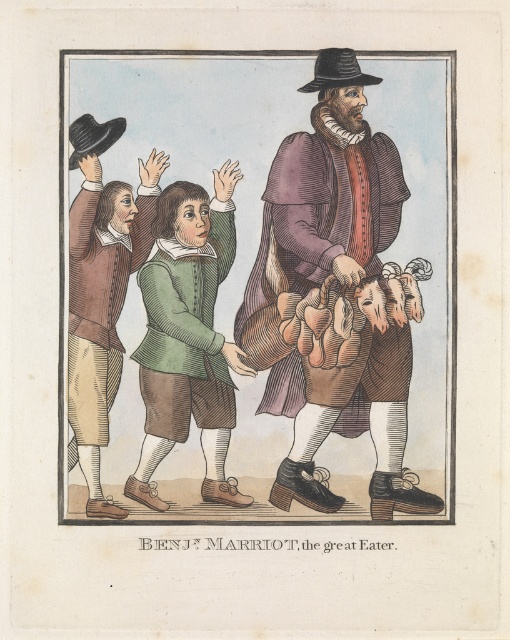
You are an assistant helping to organize a historical clothing exhibition. You have two items to display next to each other in a glass case. The items are the brown leather coat at center and the green velvet vest at center. The case has a minimum required distance of 30 inches between items for safety. Can these two items be placed side by side in the case without violating the safety distance requirement?

The brown leather coat at center is 32.09 inches from green velvet vest at center, so yes, they can be placed side by side in the case as the distance between them meets the minimum requirement of 30 inches.